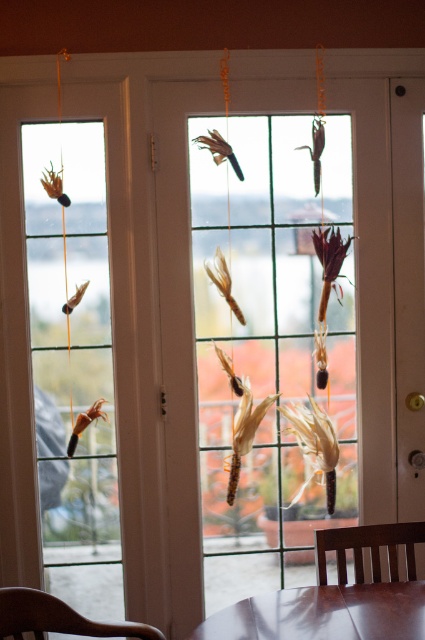
Question: Which object appears farthest from the camera in this image?

Choices:
 (A) glossy brown table at lower center
 (B) brown wood chair at lower left

Answer: (B)

Question: Can you confirm if brown wood chair at lower left is bigger than brown wooden chair at lower center?

Choices:
 (A) no
 (B) yes

Answer: (B)

Question: Can you confirm if glossy brown table at lower center is positioned above brown wood chair at lower left?

Choices:
 (A) yes
 (B) no

Answer: (A)

Question: Does glossy brown table at lower center come behind brown wooden chair at lower center?

Choices:
 (A) yes
 (B) no

Answer: (B)

Question: Which of the following is the farthest from the observer?

Choices:
 (A) brown wooden chair at lower center
 (B) brown wood chair at lower left

Answer: (A)

Question: Which point appears closest to the camera in this image?

Choices:
 (A) (380, 621)
 (B) (25, 600)

Answer: (A)